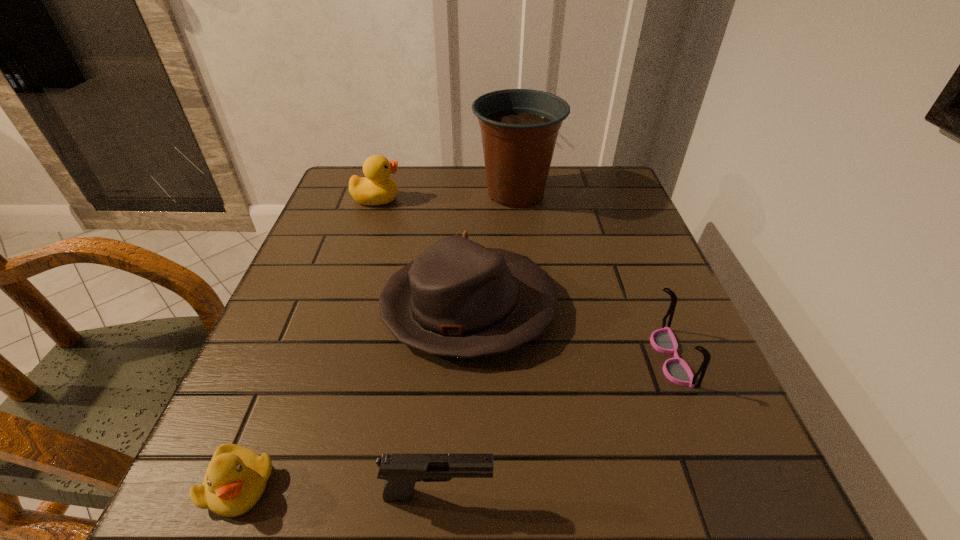
I want to click on flowerpot, so click(519, 127).

Identify the location of hat. (458, 298).

You are a GUI agent. You are given a task and a screenshot of the screen. Output one action in this format:
    pyautogui.click(x=<x>, y=<y>)
    Task: Click on the duck
    
    Given the screenshot: What is the action you would take?
    point(376,188)

The width and height of the screenshot is (960, 540). I want to click on spectacles, so click(663, 340).

Locate an element on the screen. The width and height of the screenshot is (960, 540). pistol is located at coordinates (401, 472).

What are the coordinates of `the shortest object` in the screenshot? It's located at (236, 477).

Where is `vacant space situated 0.300m on the left of the tallest object`? The image size is (960, 540). vacant space situated 0.300m on the left of the tallest object is located at coordinates (363, 193).

Where is `vacant space located on the decorative side of the hat`? This screenshot has height=540, width=960. vacant space located on the decorative side of the hat is located at coordinates (596, 308).

Locate an element on the screen. free spot located 0.340m at the beak of the duck is located at coordinates (528, 199).

At what (x,y) coordinates should I click in order to perform the action: click on free region located 0.060m on the back of the spectacles. Please return your answer as a coordinate pair (x, y). This screenshot has width=960, height=540. Looking at the image, I should click on (651, 306).